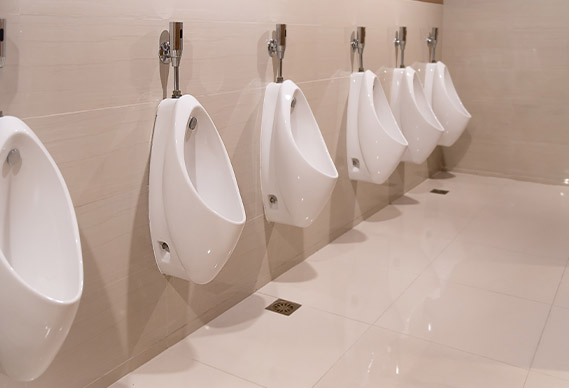
Find the location of a particular element. urinals is located at coordinates (40, 241), (206, 187), (302, 154), (382, 124), (423, 108), (445, 99).